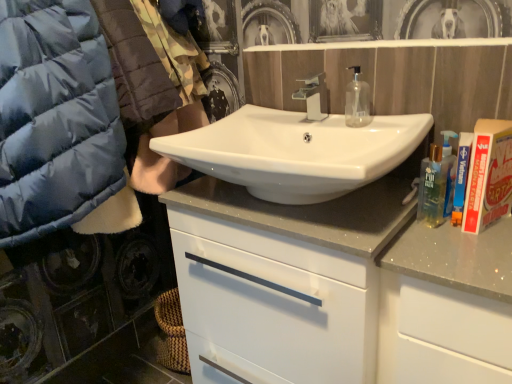
The image size is (512, 384). Identify the location of spots to the right of transparent plastic mouthwash at center. (397, 122).